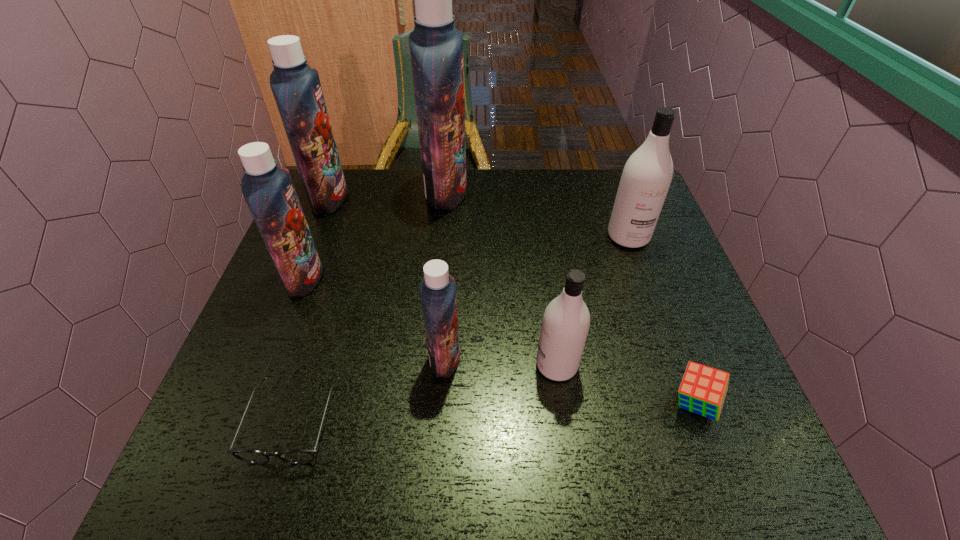
Where is `unoccupied area between the shortest object and the third farthest blue shampoo`? This screenshot has height=540, width=960. unoccupied area between the shortest object and the third farthest blue shampoo is located at coordinates (299, 349).

Image resolution: width=960 pixels, height=540 pixels. In order to click on free space between the second shortest object and the rightmost shampoo in this screenshot , I will do `click(661, 320)`.

This screenshot has height=540, width=960. Identify the location of empty space that is in between the seventh shortest object and the red cube. (512, 301).

Image resolution: width=960 pixels, height=540 pixels. I want to click on empty location between the smallest blue shampoo and the shortest object, so click(x=369, y=389).

This screenshot has height=540, width=960. I want to click on vacant area that lies between the spectacles and the third smallest blue shampoo, so click(311, 310).

Where is `the closest object to the smallest blue shampoo`? The width and height of the screenshot is (960, 540). the closest object to the smallest blue shampoo is located at coordinates (566, 320).

Select which object is the third closest to the rightmost shampoo. Please provide its 2D coordinates. Your answer should be formatted as a tuple, i.e. [(x, y)], where the tuple contains the x and y coordinates of a point satisfying the conditions above.

[(703, 389)]

Point out which shampoo is positioned as the fourth nearest to the nearest blue shampoo. Please provide its 2D coordinates. Your answer should be formatted as a tuple, i.e. [(x, y)], where the tuple contains the x and y coordinates of a point satisfying the conditions above.

[(647, 175)]

The height and width of the screenshot is (540, 960). What are the coordinates of `shampoo that is the third closest to the farther white shampoo` in the screenshot? It's located at (437, 289).

Identify the location of blue shampoo that stands as the fourth closest to the third object from right to left. This screenshot has width=960, height=540. (296, 87).